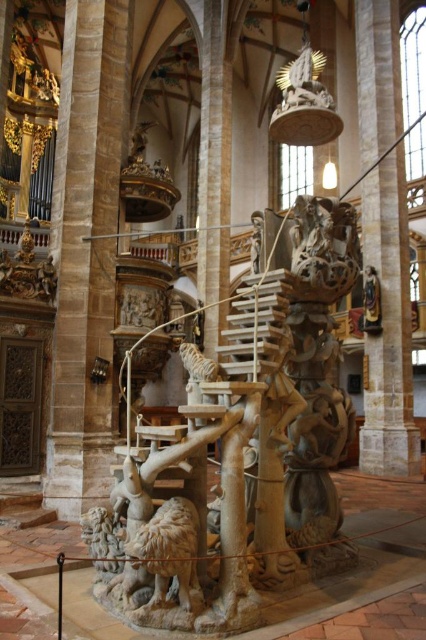
Question: Which of these objects is positioned closest to the smooth stone pillar at right?

Choices:
 (A) carved stone sculpture at center
 (B) smooth stone pillar at center
 (C) carved stone sheep at center

Answer: (B)

Question: Which of the following is the closest to the observer?

Choices:
 (A) smooth stone pillar at right
 (B) carved stone sheep at center

Answer: (B)

Question: Can you confirm if carved stone sculpture at center is bigger than carved stone sheep at center?

Choices:
 (A) yes
 (B) no

Answer: (A)

Question: Is carved stone sculpture at center thinner than smooth stone pillar at center?

Choices:
 (A) yes
 (B) no

Answer: (B)

Question: Based on their relative distances, which object is farther from the smooth stone pillar at center?

Choices:
 (A) carved stone sculpture at center
 (B) smooth stone pillar at right

Answer: (B)

Question: Can you confirm if smooth stone pillar at right is positioned to the left of carved stone sheep at center?

Choices:
 (A) no
 (B) yes

Answer: (A)